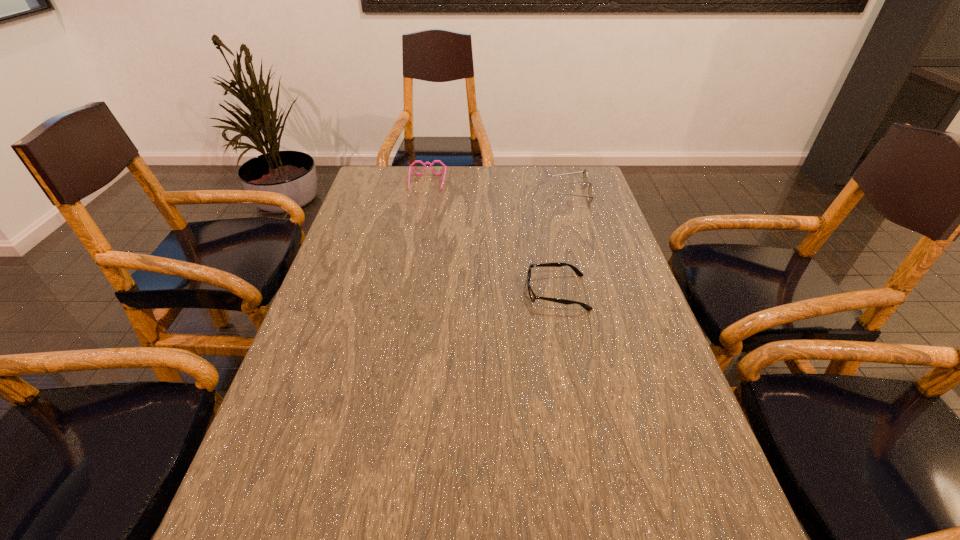
Locate an element on the screen. the tallest object is located at coordinates (590, 196).

Identify the location of the second shortest object. The image size is (960, 540). (410, 167).

This screenshot has height=540, width=960. What are the coordinates of `the leftmost spectacles` in the screenshot? It's located at (410, 167).

Identify the location of the nearest spectacles. The height and width of the screenshot is (540, 960). (533, 297).

What are the coordinates of `the nearest object` in the screenshot? It's located at (533, 297).

Image resolution: width=960 pixels, height=540 pixels. Find the location of `free location located on the front-facing side of the tallest spectacles`. free location located on the front-facing side of the tallest spectacles is located at coordinates (459, 194).

You are a GUI agent. You are given a task and a screenshot of the screen. Output one action in this format:
    pyautogui.click(x=<x>, y=<y>)
    Task: Click on the vacant space located 0.270m on the front-facing side of the tallest spectacles
    The width and height of the screenshot is (960, 540).
    Given the screenshot: What is the action you would take?
    pyautogui.click(x=468, y=194)

Locate an element on the screen. The height and width of the screenshot is (540, 960). free spot located on the front-facing side of the tallest spectacles is located at coordinates (536, 194).

Locate an element on the screen. free region located on the arms of the leftmost object is located at coordinates (418, 238).

In order to click on vacant space located on the front-facing side of the shortest object in this screenshot , I will do `click(445, 293)`.